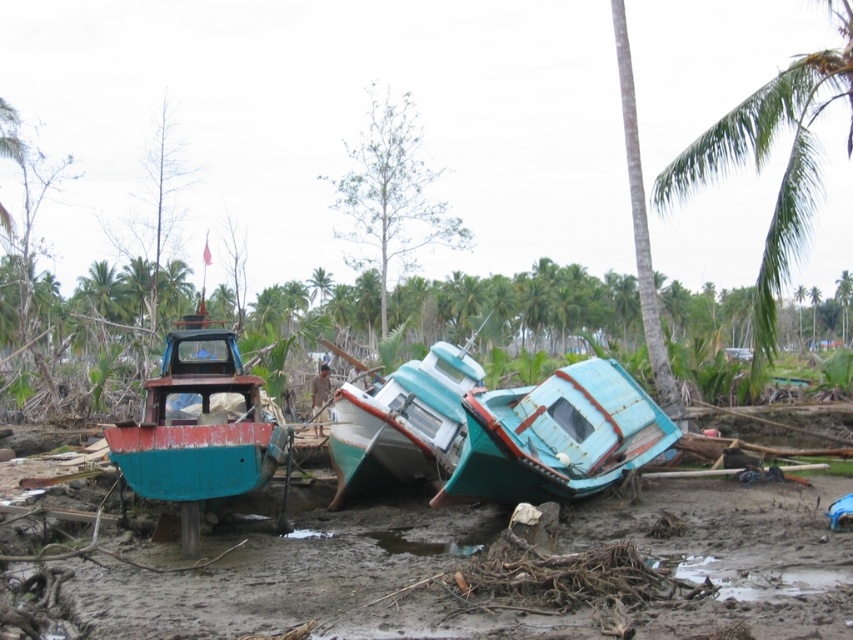
Who is higher up, rusty metal boat at left or green leafy palm tree at upper right?

green leafy palm tree at upper right

Between point (119, 442) and point (799, 93), which one is positioned in front?

Point (119, 442)

Image resolution: width=853 pixels, height=640 pixels. Identify the location of rusty metal boat at left. (200, 426).

Consider the image. Who is more forward, (845, 49) or (401, 484)?

Point (401, 484) is more forward.

Who is more distant from viewer, (808, 236) or (361, 481)?

The point (808, 236) is behind.

This screenshot has width=853, height=640. Find the location of `green leafy palm tree at upper right`. green leafy palm tree at upper right is located at coordinates (766, 157).

Locate an element on the screen. This screenshot has width=853, height=640. green leafy palm tree at upper right is located at coordinates (766, 157).

Between rusty metal boat at left and green leafy palm tree at upper center, which one has more height?

rusty metal boat at left

Can you confirm if rusty metal boat at left is shorter than green leafy palm tree at upper center?

No.

Which is in front, point (113, 442) or point (314, 285)?

Point (113, 442) is more forward.

In order to click on rusty metal boat at left in this screenshot , I will do `click(200, 426)`.